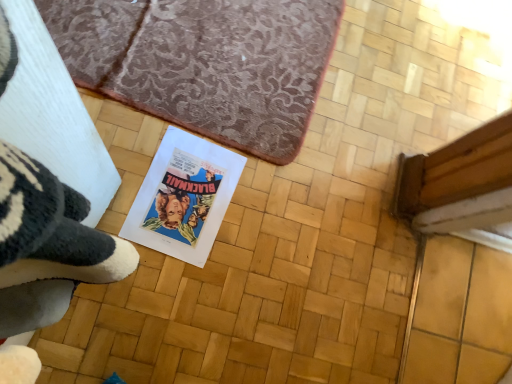
Question: Do you think matte paper book at center is within brown textured rug at upper center, or outside of it?

Choices:
 (A) inside
 (B) outside

Answer: (B)

Question: From the image's perspective, relative to brown textured rug at upper center, is matte paper book at center above or below?

Choices:
 (A) above
 (B) below

Answer: (B)

Question: Looking at their shapes, would you say matte paper book at center is wider or thinner than brown textured rug at upper center?

Choices:
 (A) wide
 (B) thin

Answer: (B)

Question: Is point (247, 48) positioned closer to the camera than point (244, 160)?

Choices:
 (A) farther
 (B) closer

Answer: (A)

Question: Based on their positions, is brown textured rug at upper center located to the left or right of matte paper book at center?

Choices:
 (A) right
 (B) left

Answer: (A)

Question: From a real-world perspective, relative to matte paper book at center, is brown textured rug at upper center vertically above or below?

Choices:
 (A) below
 (B) above

Answer: (B)

Question: Is brown textured rug at upper center in front of or behind matte paper book at center in the image?

Choices:
 (A) front
 (B) behind

Answer: (B)